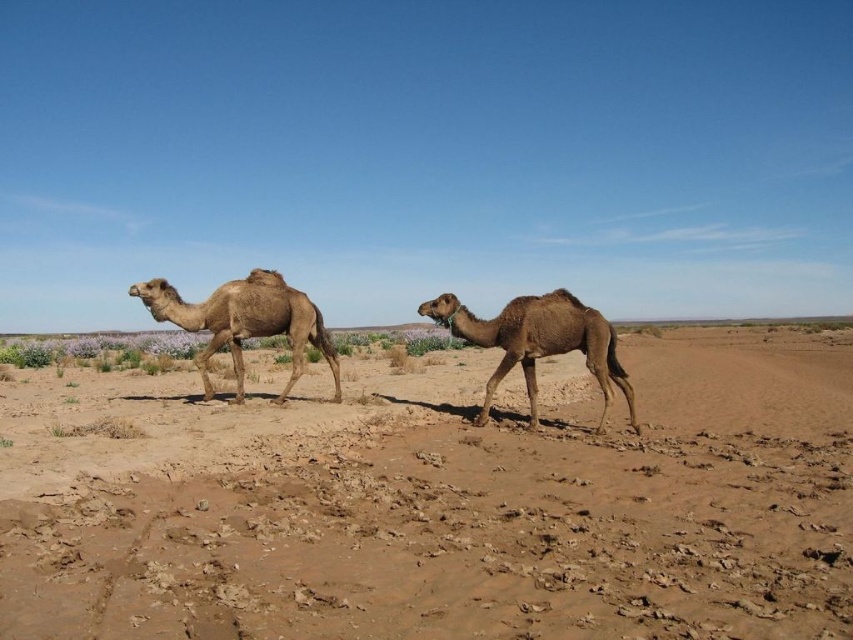
Can you confirm if brown matte camel at center is thinner than desert tan camel at left?

Indeed, brown matte camel at center has a lesser width compared to desert tan camel at left.

Which is above, brown matte camel at center or desert tan camel at left?

Positioned higher is desert tan camel at left.

At what (x,y) coordinates should I click in order to perform the action: click on brown matte camel at center. Please return your answer as a coordinate pair (x, y). The height and width of the screenshot is (640, 853). Looking at the image, I should click on (538, 342).

Can you confirm if brown sandy dirt at center is taller than brown matte camel at center?

No, brown sandy dirt at center is not taller than brown matte camel at center.

Locate an element on the screen. The width and height of the screenshot is (853, 640). brown sandy dirt at center is located at coordinates (489, 522).

From the picture: Can you confirm if brown sandy dirt at center is bigger than desert tan camel at left?

Correct, brown sandy dirt at center is larger in size than desert tan camel at left.

From the picture: Can you confirm if brown sandy dirt at center is wider than desert tan camel at left?

Yes.

Identify the location of brown sandy dirt at center. Image resolution: width=853 pixels, height=640 pixels. (489, 522).